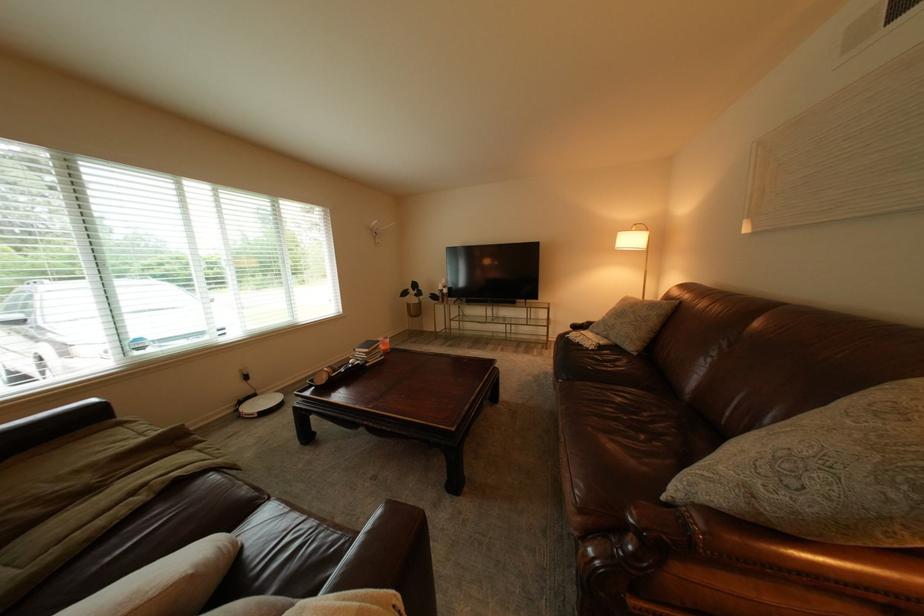
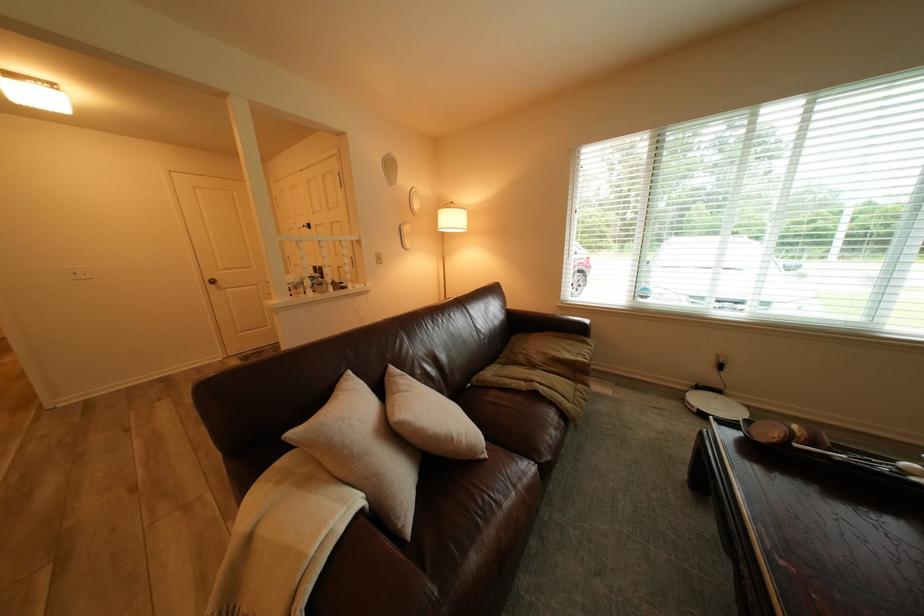
The point at (254, 403) is marked in the first image. Where is the corresponding point in the second image?

(712, 389)